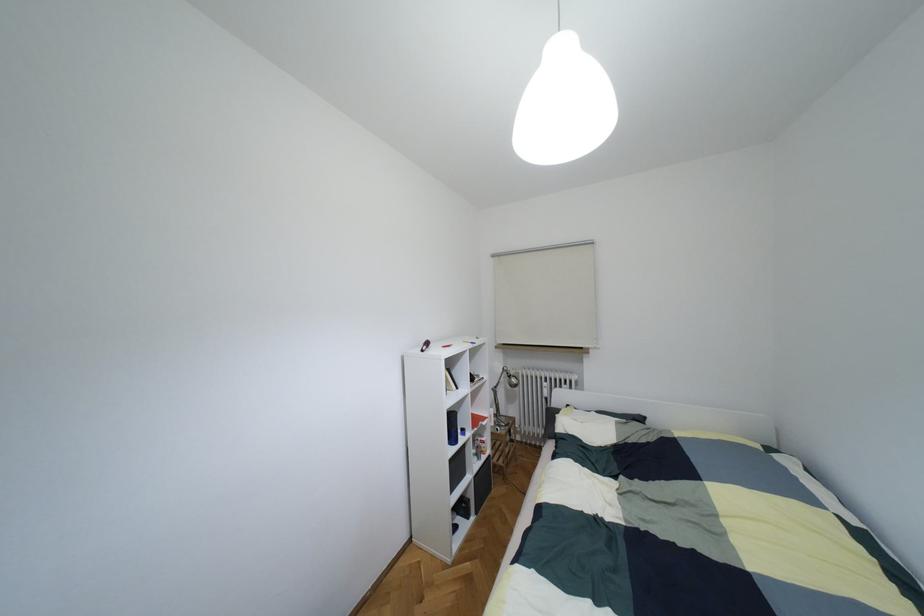
Where would you sit the stool sitting surface? Please return your answer as a coordinate pair (x, y).

(504, 475)